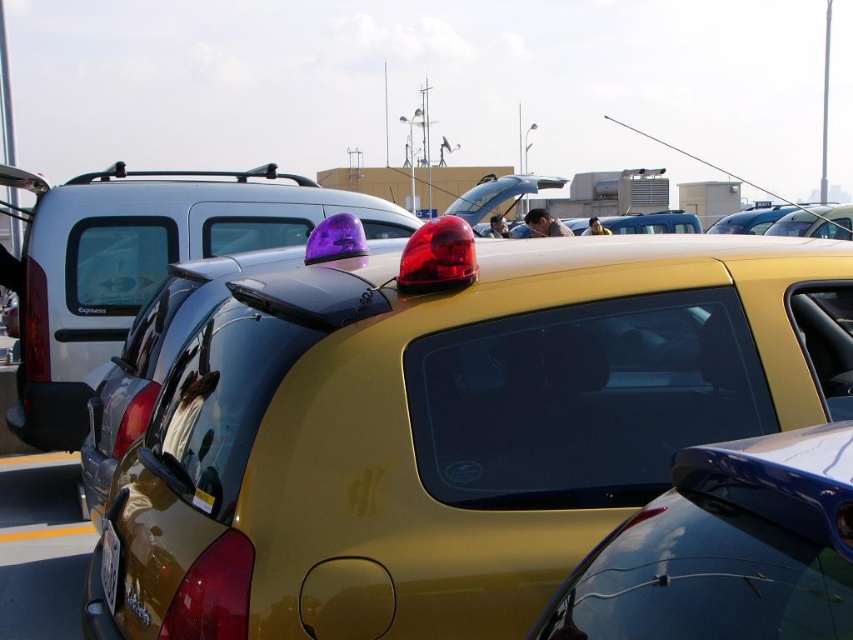
Who is positioned more to the right, metallic yellow taxi at center or glossy blue spoiler at upper right?

glossy blue spoiler at upper right

Is metallic yellow taxi at center positioned at the back of glossy blue spoiler at upper right?

Yes.

Which is in front, point (247, 323) or point (792, 477)?

Positioned in front is point (792, 477).

Locate an element on the screen. The width and height of the screenshot is (853, 640). metallic yellow taxi at center is located at coordinates (451, 424).

Does yellow matte line at lower center have a greater height compared to black glossy line at lower left?

In fact, yellow matte line at lower center may be shorter than black glossy line at lower left.

Between point (49, 531) and point (19, 460), which one is positioned in front?

Point (49, 531) is in front.

Find the location of a particular element. This screenshot has height=640, width=853. yellow matte line at lower center is located at coordinates (44, 532).

Does metallic yellow taxi at center have a lesser width compared to yellow plastic license plate at lower center?

No, metallic yellow taxi at center is not thinner than yellow plastic license plate at lower center.

In the scene shown: Measure the distance between metallic yellow taxi at center and yellow plastic license plate at lower center.

metallic yellow taxi at center and yellow plastic license plate at lower center are 37.82 inches apart from each other.

Find the location of `metallic yellow taxi at center`. metallic yellow taxi at center is located at coordinates (451, 424).

The width and height of the screenshot is (853, 640). In order to click on metallic yellow taxi at center in this screenshot , I will do `click(451, 424)`.